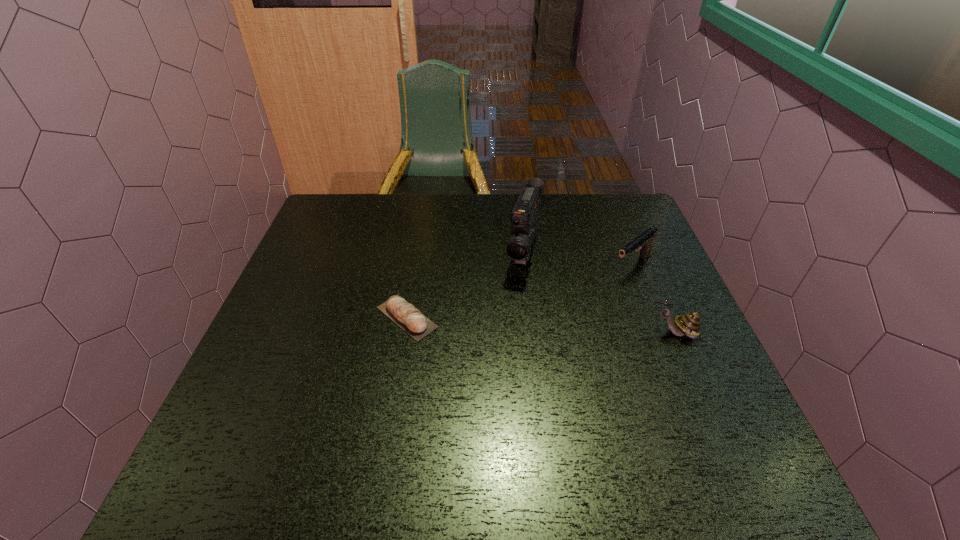
Find the location of a particular element. free space on the desktop that is between the leftmost object and the snail and is positioned at the muzzle of the pistol is located at coordinates (556, 326).

The width and height of the screenshot is (960, 540). What are the coordinates of `vacant space on the desktop that is between the shortest object and the snail and is positioned on the front-facing side of the second object from left to right` in the screenshot? It's located at (507, 323).